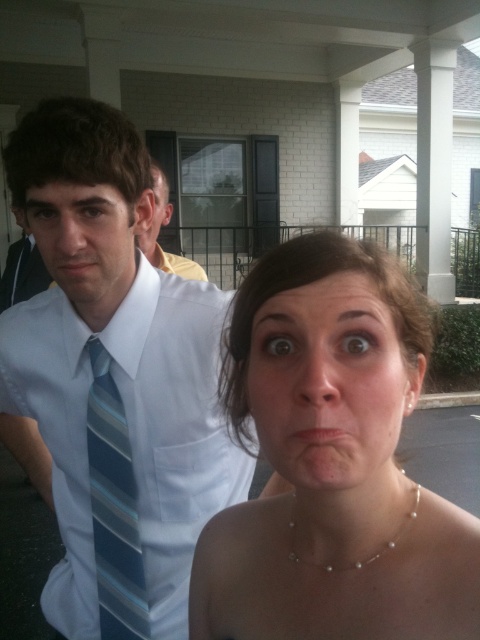
Who is more distant from viewer, (44, 433) or (269, 486)?

Point (269, 486)

Does white striped tie at left appear under smooth skin face at center?

Indeed, white striped tie at left is positioned under smooth skin face at center.

Between point (183, 532) and point (319, 342), which one is positioned behind?

Positioned behind is point (183, 532).

Find the location of a particular element. The height and width of the screenshot is (640, 480). white striped tie at left is located at coordinates (129, 433).

Can you confirm if smooth skin face at center is positioned below matte white shirt at center?

Yes.

Does smooth skin face at center have a larger size compared to matte white shirt at center?

No.

Where is `smooth skin face at center`? The image size is (480, 640). smooth skin face at center is located at coordinates (328, 385).

You are a GUI agent. You are given a task and a screenshot of the screen. Output one action in this format:
    pyautogui.click(x=<x>, y=<y>)
    Task: Click on the smooth skin face at center
    
    Given the screenshot: What is the action you would take?
    pyautogui.click(x=328, y=385)

Does white striped tie at left appear under white shirt at center?

Yes.

Is point (191, 404) positioned in front of point (204, 273)?

Yes.

The height and width of the screenshot is (640, 480). In order to click on white striped tie at left in this screenshot , I will do `click(129, 433)`.